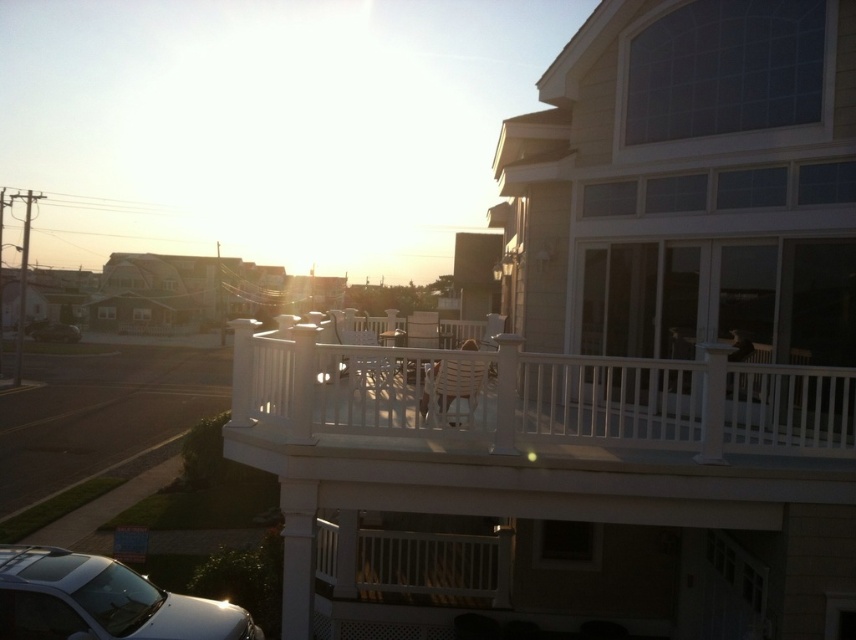
Does satin silver suv at lower left appear on the right side of metallic silver car at lower left?

Correct, you'll find satin silver suv at lower left to the right of metallic silver car at lower left.

Is satin silver suv at lower left wider than metallic silver car at lower left?

Incorrect, satin silver suv at lower left's width does not surpass metallic silver car at lower left's.

Which is behind, point (116, 600) or point (51, 321)?

The point (51, 321) is behind.

Identify the location of satin silver suv at lower left. (102, 602).

Is white plastic porch at center to the left of metallic silver car at lower left from the viewer's perspective?

Incorrect, white plastic porch at center is not on the left side of metallic silver car at lower left.

Measure the distance from white plastic porch at center to metallic silver car at lower left.

white plastic porch at center and metallic silver car at lower left are 60.34 meters apart from each other.

Between point (473, 394) and point (58, 337), which one is positioned in front?

Point (473, 394) is in front.

Identify the location of white plastic porch at center. (538, 396).

Between point (678, 433) and point (107, 627), which one is positioned behind?

The point (678, 433) is behind.

Can you confirm if white plastic porch at center is taller than satin silver suv at lower left?

Yes.

Does point (847, 384) come in front of point (88, 596)?

That is True.

In order to click on white plastic porch at center in this screenshot , I will do `click(538, 396)`.